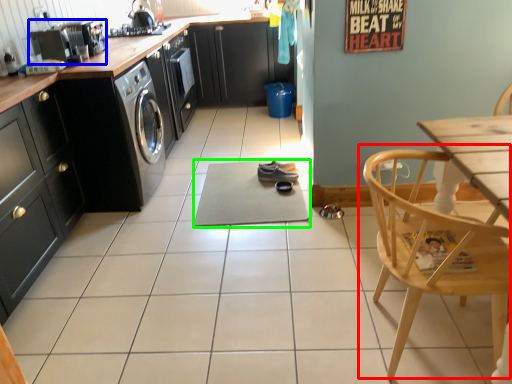
Question: Estimate the real-world distances between objects in this image. Which object is closer to chair (highlighted by a red box), kitchen appliance (highlighted by a blue box) or yoga mat (highlighted by a green box)?

Choices:
 (A) kitchen appliance
 (B) yoga mat

Answer: (B)